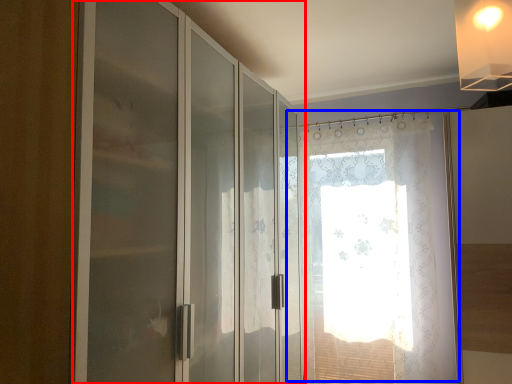
Question: Among these objects, which one is farthest to the camera, door (highlighted by a red box) or window (highlighted by a blue box)?

Choices:
 (A) door
 (B) window

Answer: (B)